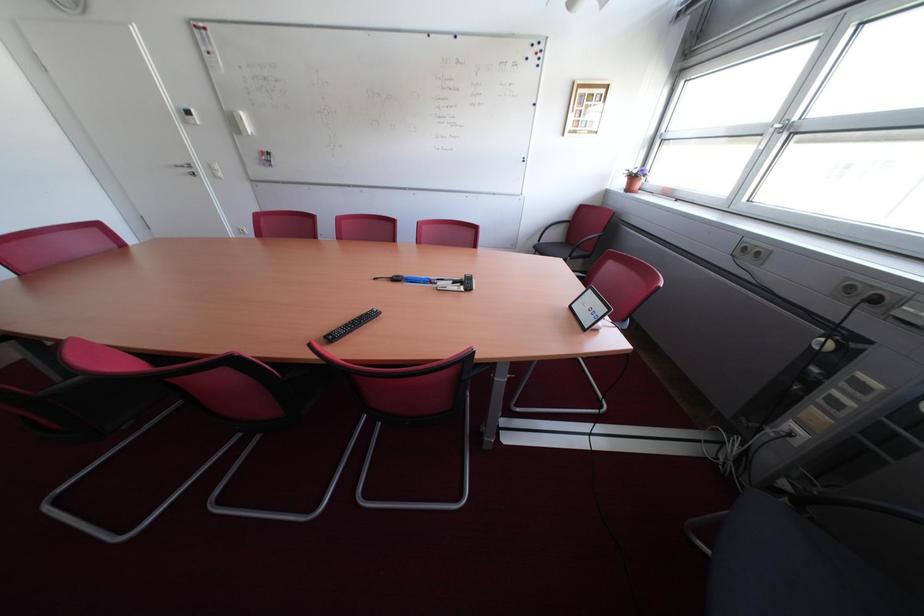
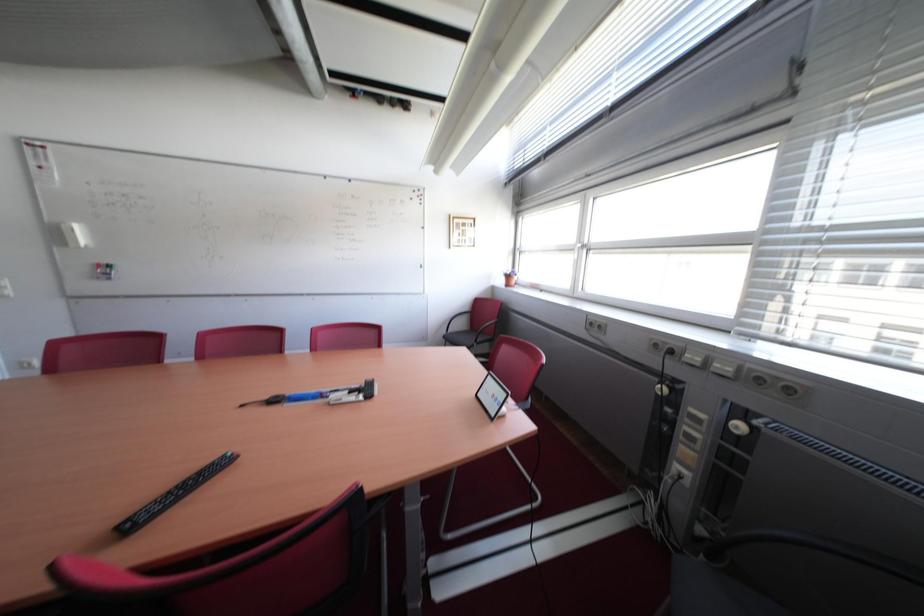
Question: What movement of the cameraman would produce the second image?

Choices:
 (A) Left
 (B) Right
 (C) Forward
 (D) Backward

Answer: (B)